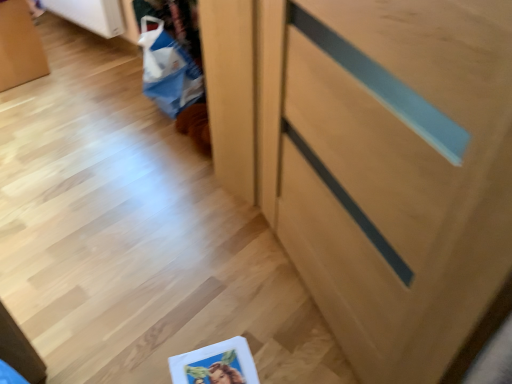
Question: From the image's perspective, is blue paper bag at lower left positioned above or below light wood cabinet at center?

Choices:
 (A) below
 (B) above

Answer: (B)

Question: Based on their sizes in the image, would you say blue paper bag at lower left is bigger or smaller than light wood cabinet at center?

Choices:
 (A) small
 (B) big

Answer: (A)

Question: Is point (173, 105) closer or farther from the camera than point (431, 145)?

Choices:
 (A) closer
 (B) farther

Answer: (B)

Question: Is point (362, 13) closer or farther from the camera than point (165, 102)?

Choices:
 (A) closer
 (B) farther

Answer: (A)

Question: Looking at the image, does light wood cabinet at center seem bigger or smaller compared to blue paper bag at lower left?

Choices:
 (A) small
 (B) big

Answer: (B)

Question: From a real-world perspective, relative to blue paper bag at lower left, is light wood cabinet at center vertically above or below?

Choices:
 (A) below
 (B) above

Answer: (B)

Question: Would you say light wood cabinet at center is to the left or to the right of blue paper bag at lower left in the picture?

Choices:
 (A) left
 (B) right

Answer: (B)